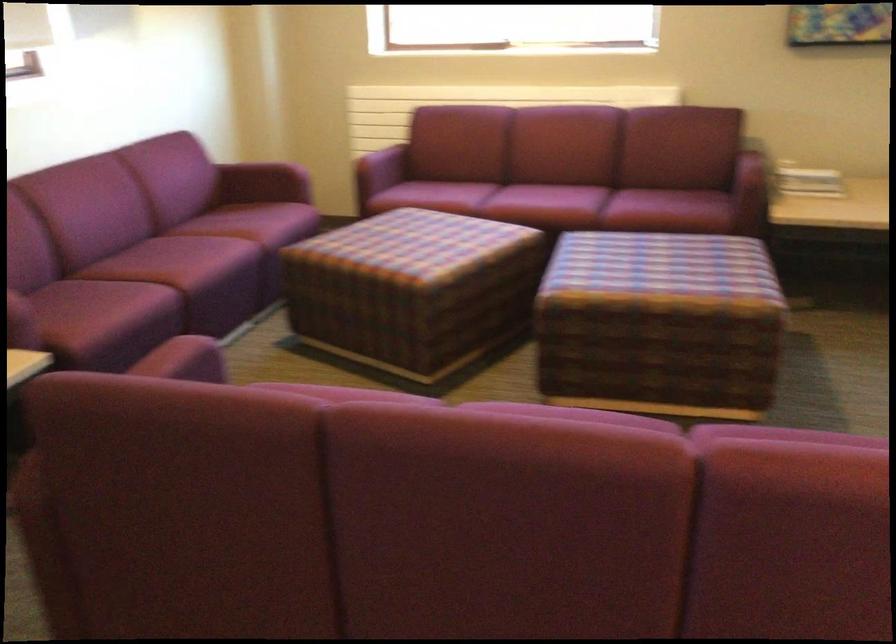
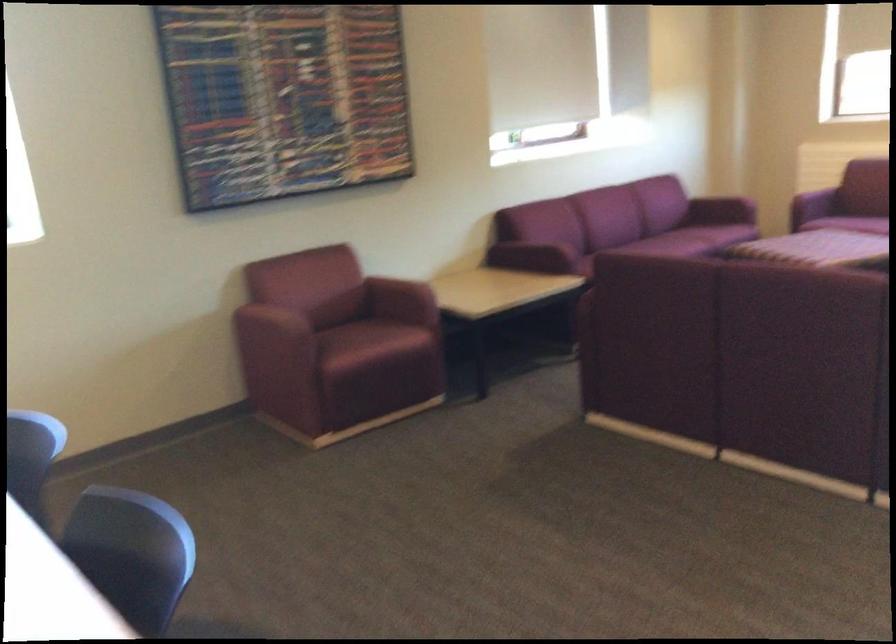
Question: I am providing you with two images of the same scene from different viewpoints. Which of the following objects are not visible in image2?

Choices:
 (A) maroon sofa sitting surface
 (B) yellow library book
 (C) maroon chair armrest
 (D) purple sofa armrest

Answer: (D)